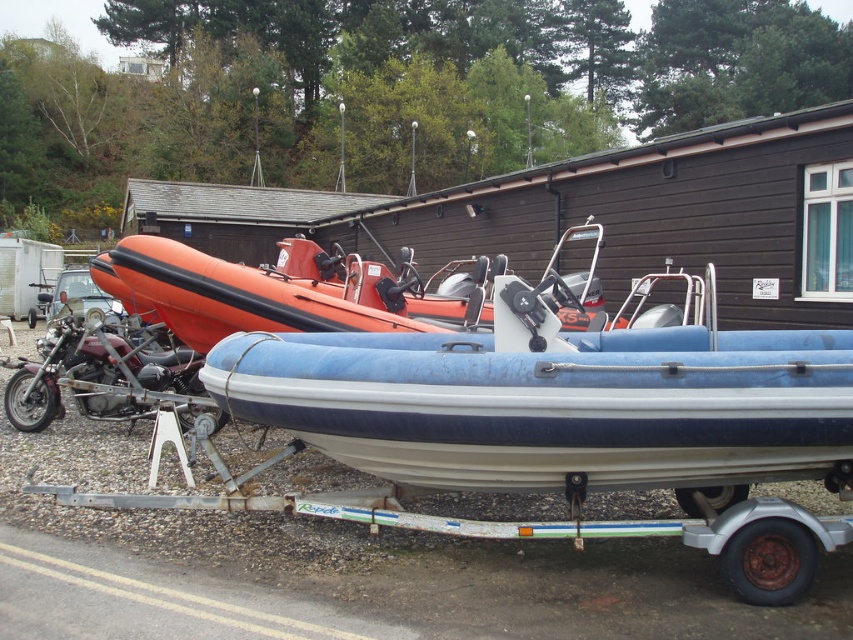
You are a delivery person who needs to transport a 4 meter long container between the blue rubber boat at center and the shiny chrome motorcycle at left. Can you fit the container between them without moving either object?

The blue rubber boat at center and the shiny chrome motorcycle at left are 3.99 meters apart. Since the container is 4 meters long, it is slightly longer than the available space between them. Therefore, the container cannot fit between them without moving either object.

You are standing in the boat storage area and want to know which of the two points, point (x=722, y=376) or point (x=142, y=374), is closer to you. Which one is it?

Point (x=722, y=376) is closer to the camera than point (x=142, y=374), so it is closer to you.

Please provide the 2D coordinates of the blue rubber boat at center in the image. The coordinates should be in the format of a point with two decimal places, like this example format point format. The scene is a boat storage area with a blue and white inflatable boat mounted on a trailer in the foreground. There is also an orange inflatable boat behind it. You can see a paved road in the bottom left corner.

The 2D coordinates of the blue rubber boat at center are point (553, 401).